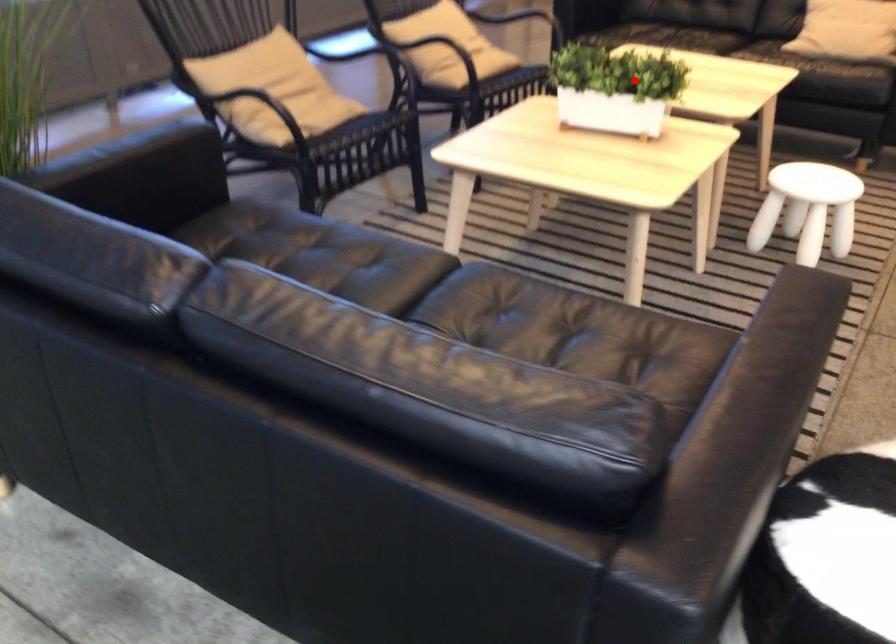
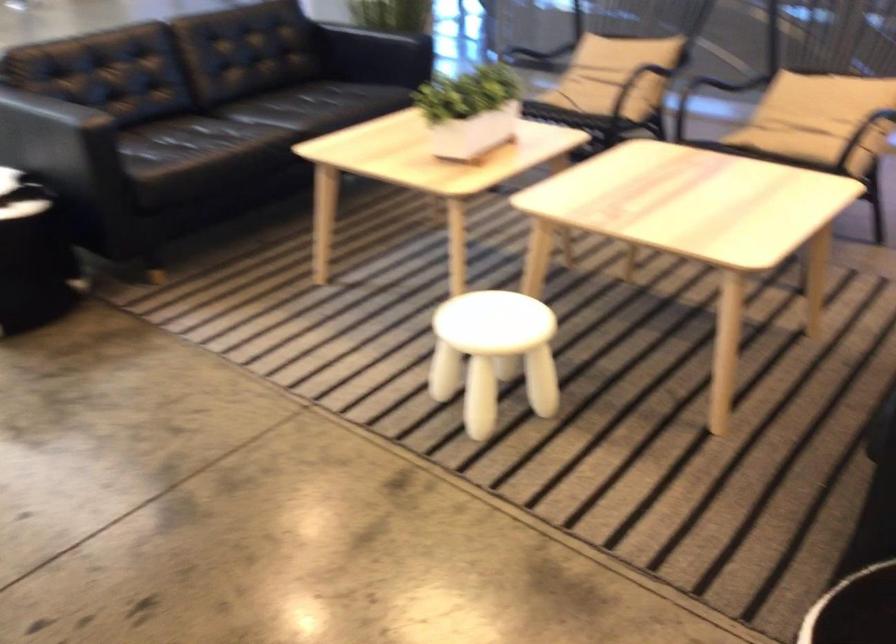
Locate, in the second image, the point that corresponds to the highlighted location in the first image.

(470, 111)